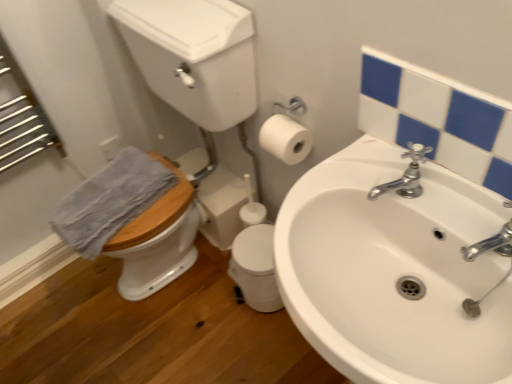
The image size is (512, 384). Describe the element at coordinates (285, 139) in the screenshot. I see `white matte toilet paper at upper right` at that location.

Identify the location of blue textured towel at left. (111, 201).

This screenshot has height=384, width=512. In order to click on wooden at left in this screenshot , I will do coord(190,113).

Between white glossy mirror at upper right and silver metallic faucet at upper right, which one is positioned behind?

silver metallic faucet at upper right is further away from the camera.

In the image, is white glossy mirror at upper right on the left side or the right side of silver metallic faucet at upper right?

white glossy mirror at upper right is to the right of silver metallic faucet at upper right.

Can you tell me how much white glossy mirror at upper right and silver metallic faucet at upper right differ in facing direction?

The facing directions of white glossy mirror at upper right and silver metallic faucet at upper right are 3.17 degrees apart.

Find the location of `tap that is behind the white glossy mirror at upper right`. tap that is behind the white glossy mirror at upper right is located at coordinates click(406, 175).

Is blue textured towel at left to the left or to the right of white glossy mirror at upper right in the image?

In the image, blue textured towel at left appears on the left side of white glossy mirror at upper right.

From the image's perspective, does blue textured towel at left appear lower than white glossy mirror at upper right?

Indeed, from the image's perspective, blue textured towel at left is shown beneath white glossy mirror at upper right.

From their relative heights in the image, would you say blue textured towel at left is taller or shorter than white glossy mirror at upper right?

Clearly, blue textured towel at left is shorter compared to white glossy mirror at upper right.

Considering the relative sizes of white glossy mirror at upper right and white ceramic sink at center in the image provided, is white glossy mirror at upper right thinner than white ceramic sink at center?

Indeed, white glossy mirror at upper right has a lesser width compared to white ceramic sink at center.

Is white glossy mirror at upper right shorter than white ceramic sink at center?

Correct, white glossy mirror at upper right is not as tall as white ceramic sink at center.

From the picture: Is white glossy mirror at upper right looking in the opposite direction of white ceramic sink at center?

No.

From the image's perspective, which is below, white glossy mirror at upper right or white ceramic sink at center?

white ceramic sink at center is shown below in the image.

Based on the photo, what's the angular difference between white glossy mirror at upper right and white matte toilet paper at upper right's facing directions?

There is a 0.24-degree angle between the facing directions of white glossy mirror at upper right and white matte toilet paper at upper right.

Which of these two, white glossy mirror at upper right or white matte toilet paper at upper right, is smaller?

With smaller size is white matte toilet paper at upper right.

Who is more distant, white glossy mirror at upper right or white matte toilet paper at upper right?

white matte toilet paper at upper right is further from the camera.

Is there a large distance between white glossy mirror at upper right and white matte toilet paper at upper right?

No.

Is silver metallic faucet at upper right turned away from blue textured towel at left?

No, silver metallic faucet at upper right is not facing away from blue textured towel at left.

Can you confirm if silver metallic faucet at upper right is shorter than blue textured towel at left?

In fact, silver metallic faucet at upper right may be taller than blue textured towel at left.

Consider the image. Does silver metallic faucet at upper right have a smaller size compared to blue textured towel at left?

Yes, silver metallic faucet at upper right is smaller than blue textured towel at left.

Which object is further away from the camera, silver metallic faucet at upper right or blue textured towel at left?

Positioned behind is blue textured towel at left.

Considering the points (278, 128) and (399, 179), which point is behind, point (278, 128) or point (399, 179)?

The point (278, 128) is behind.

Find the location of `tap below the white matte toilet paper at upper right (from the image's perspective)`. tap below the white matte toilet paper at upper right (from the image's perspective) is located at coordinates (406, 175).

From the image's perspective, is white matte toilet paper at upper right above silver metallic faucet at upper right?

Yes, from the image's perspective, white matte toilet paper at upper right is over silver metallic faucet at upper right.

Considering the sizes of objects white ceramic sink at center and white glossy mirror at upper right in the image provided, who is shorter, white ceramic sink at center or white glossy mirror at upper right?

white glossy mirror at upper right is shorter.

Considering the sizes of white ceramic sink at center and white glossy mirror at upper right in the image, is white ceramic sink at center wider or thinner than white glossy mirror at upper right?

Considering their sizes, white ceramic sink at center looks broader than white glossy mirror at upper right.

From a real-world perspective, who is located higher, white ceramic sink at center or white glossy mirror at upper right?

white glossy mirror at upper right.

From the image's perspective, which one is positioned higher, white ceramic sink at center or white glossy mirror at upper right?

white glossy mirror at upper right, from the image's perspective.

Where is `tap behind the white glossy mirror at upper right`? This screenshot has height=384, width=512. tap behind the white glossy mirror at upper right is located at coordinates (406, 175).

This screenshot has height=384, width=512. I want to click on mirror in front of the blue textured towel at left, so click(x=438, y=119).

From the image, which object appears to be farther from blue textured towel at left, wooden at left or white ceramic sink at center?

Among the two, white ceramic sink at center is located further to blue textured towel at left.

Estimate the real-world distances between objects in this image. Which object is further from white ceramic sink at center, white matte toilet paper at upper right or white glossy mirror at upper right?

white matte toilet paper at upper right is positioned further to the anchor white ceramic sink at center.

Estimate the real-world distances between objects in this image. Which object is closer to white glossy mirror at upper right, white ceramic sink at center or blue textured towel at left?

Among the two, white ceramic sink at center is located nearer to white glossy mirror at upper right.

Looking at the image, which one is located closer to white ceramic sink at center, white glossy mirror at upper right or wooden at left?

Based on the image, white glossy mirror at upper right appears to be nearer to white ceramic sink at center.

Looking at the image, which one is located further to white glossy mirror at upper right, silver metallic faucet at upper right or wooden at left?

wooden at left.

From the image, which object appears to be nearer to silver metallic faucet at upper right, white glossy mirror at upper right or wooden at left?

white glossy mirror at upper right lies closer to silver metallic faucet at upper right than the other object.

From the image, which object appears to be nearer to white glossy mirror at upper right, wooden at left or silver metallic faucet at upper right?

silver metallic faucet at upper right lies closer to white glossy mirror at upper right than the other object.

Considering their positions, is white glossy mirror at upper right positioned further to white ceramic sink at center than silver metallic faucet at upper right?

Based on the image, white glossy mirror at upper right appears to be further to white ceramic sink at center.

Where is `tap situated between wooden at left and white glossy mirror at upper right from left to right`? The width and height of the screenshot is (512, 384). tap situated between wooden at left and white glossy mirror at upper right from left to right is located at coordinates [x=406, y=175].

You are a GUI agent. You are given a task and a screenshot of the screen. Output one action in this format:
    pyautogui.click(x=<x>, y=<y>)
    Task: Click on the sink between blue textured towel at left and white glossy mirror at upper right in the horizontal direction
    
    Given the screenshot: What is the action you would take?
    pyautogui.click(x=394, y=271)

Where is `toilet paper between wooden at left and white ceramic sink at center from left to right`? toilet paper between wooden at left and white ceramic sink at center from left to right is located at coordinates (285, 139).

The height and width of the screenshot is (384, 512). In order to click on toilet paper located between wooden at left and white glossy mirror at upper right in the left-right direction in this screenshot , I will do `click(285, 139)`.